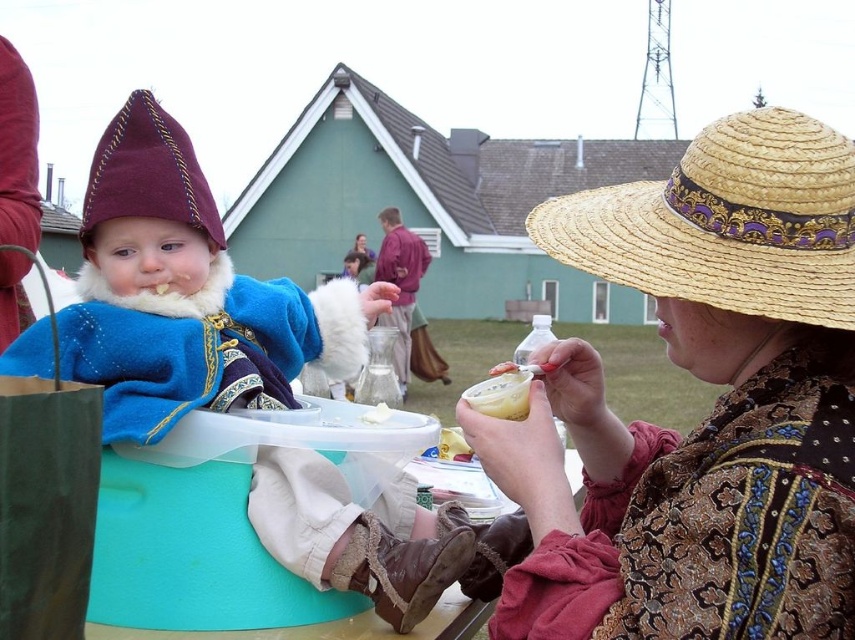
Looking at this image, does rustic straw hat at upper right come behind velvet blue robe at center?

Yes.

What do you see at coordinates (712, 410) in the screenshot?
I see `rustic straw hat at upper right` at bounding box center [712, 410].

Locate an element on the screen. The width and height of the screenshot is (855, 640). rustic straw hat at upper right is located at coordinates (712, 410).

Who is lower down, velvet blue robe at center or straw hat at upper right?

velvet blue robe at center

At what (x,y) coordinates should I click in order to perform the action: click on velvet blue robe at center. Please return your answer as a coordinate pair (x, y). Looking at the image, I should click on (187, 294).

Is velvet blue robe at center bigger than natural straw hat at center?

Actually, velvet blue robe at center might be smaller than natural straw hat at center.

I want to click on velvet blue robe at center, so click(x=187, y=294).

I want to click on velvet blue robe at center, so click(187, 294).